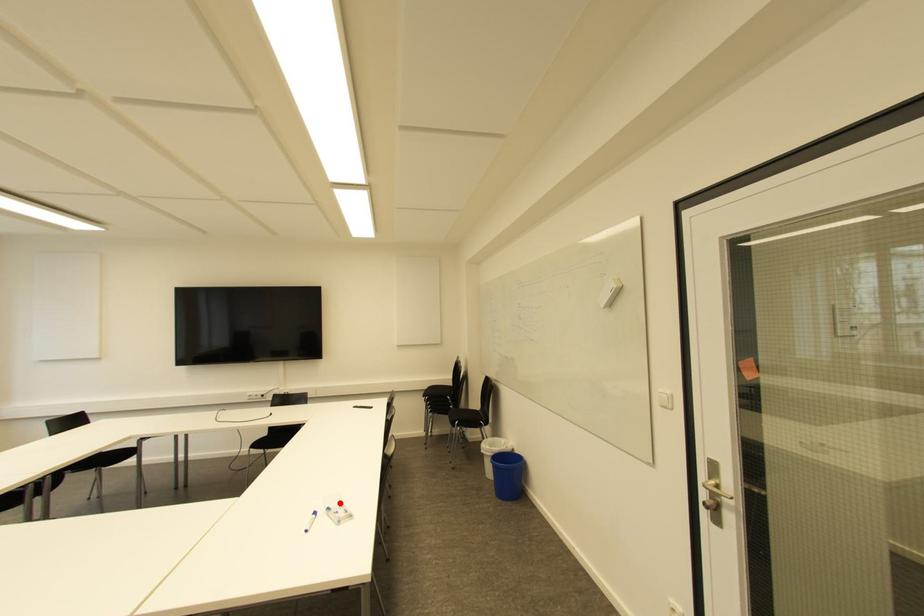
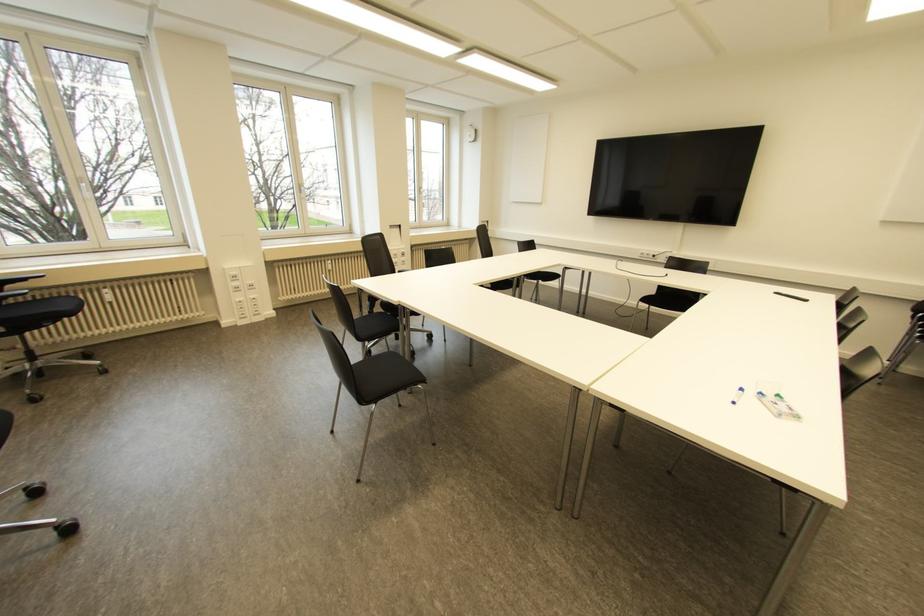
In the second image, find the point that corresponds to the highlighted location in the first image.

(777, 395)